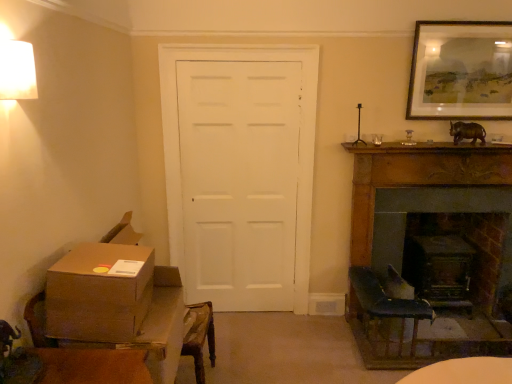
Question: Is dark wood fireplace at right, which is counted as the 2th fireplace, starting from the front, shorter than wooden framed artwork at upper right?

Choices:
 (A) no
 (B) yes

Answer: (A)

Question: From the image's perspective, does dark wood fireplace at right, acting as the first fireplace starting from the back, appear lower than wooden framed artwork at upper right?

Choices:
 (A) yes
 (B) no

Answer: (A)

Question: From a real-world perspective, is dark wood fireplace at right, which is counted as the 2th fireplace, starting from the front, beneath wooden framed artwork at upper right?

Choices:
 (A) no
 (B) yes

Answer: (B)

Question: Is dark wood fireplace at right, acting as the first fireplace starting from the back, facing away from wooden framed artwork at upper right?

Choices:
 (A) yes
 (B) no

Answer: (B)

Question: From the image's perspective, is dark wood fireplace at right, which is counted as the 2th fireplace, starting from the front, located above wooden framed artwork at upper right?

Choices:
 (A) no
 (B) yes

Answer: (A)

Question: Does point (155, 324) appear closer or farther from the camera than point (245, 284)?

Choices:
 (A) farther
 (B) closer

Answer: (B)

Question: Looking at their shapes, would you say brown cardboard box at lower left is wider or thinner than white matte door at center?

Choices:
 (A) thin
 (B) wide

Answer: (B)

Question: In terms of size, does brown cardboard box at lower left appear bigger or smaller than white matte door at center?

Choices:
 (A) small
 (B) big

Answer: (A)

Question: From a real-world perspective, is brown cardboard box at lower left positioned above or below white matte door at center?

Choices:
 (A) above
 (B) below

Answer: (B)

Question: From the image's perspective, is white matte door at center positioned above or below dark wood fireplace at right, acting as the first fireplace starting from the back?

Choices:
 (A) above
 (B) below

Answer: (A)

Question: Which is correct: white matte door at center is inside dark wood fireplace at right, acting as the first fireplace starting from the back, or outside of it?

Choices:
 (A) outside
 (B) inside

Answer: (A)

Question: Considering the positions of white matte door at center and dark wood fireplace at right, acting as the first fireplace starting from the back, in the image, is white matte door at center wider or thinner than dark wood fireplace at right, acting as the first fireplace starting from the back,?

Choices:
 (A) wide
 (B) thin

Answer: (B)

Question: Is point (166, 120) positioned closer to the camera than point (483, 190)?

Choices:
 (A) closer
 (B) farther

Answer: (A)

Question: In terms of size, does brown cardboard box at lower left appear bigger or smaller than wooden framed artwork at upper right?

Choices:
 (A) big
 (B) small

Answer: (A)

Question: Considering the positions of point (98, 248) and point (416, 76), is point (98, 248) closer or farther from the camera than point (416, 76)?

Choices:
 (A) closer
 (B) farther

Answer: (A)